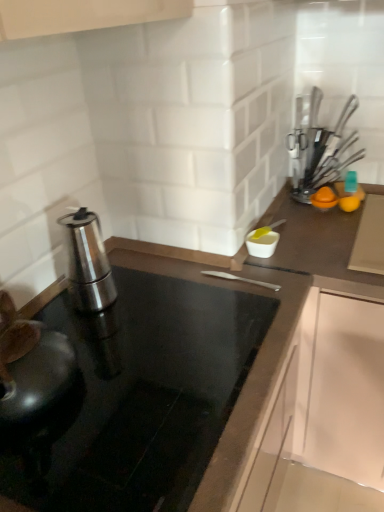
Question: Is polished stainless steel espresso maker at left, arranged as the second kitchen appliance when viewed from the top, positioned before black glass countertop at center?

Choices:
 (A) no
 (B) yes

Answer: (A)

Question: Can you confirm if polished stainless steel espresso maker at left, arranged as the 2th kitchen appliance when viewed from the back, is thinner than black glass countertop at center?

Choices:
 (A) yes
 (B) no

Answer: (A)

Question: Is polished stainless steel espresso maker at left, acting as the 1th kitchen appliance starting from the bottom, taller than black glass countertop at center?

Choices:
 (A) yes
 (B) no

Answer: (A)

Question: Is the surface of polished stainless steel espresso maker at left, arranged as the 2th kitchen appliance when viewed from the back, in direct contact with black glass countertop at center?

Choices:
 (A) no
 (B) yes

Answer: (A)

Question: Is polished stainless steel espresso maker at left, arranged as the second kitchen appliance when viewed from the top, smaller than black glass countertop at center?

Choices:
 (A) yes
 (B) no

Answer: (A)

Question: Does polished stainless steel espresso maker at left, which is the first kitchen appliance from front to back, turn towards black glass countertop at center?

Choices:
 (A) no
 (B) yes

Answer: (A)

Question: Is black glass countertop at center to the right of polished stainless steel espresso maker at left, acting as the 1th kitchen appliance starting from the bottom, from the viewer's perspective?

Choices:
 (A) no
 (B) yes

Answer: (B)

Question: Does black glass countertop at center have a greater width compared to polished stainless steel espresso maker at left, acting as the 1th kitchen appliance starting from the bottom?

Choices:
 (A) no
 (B) yes

Answer: (B)

Question: From a real-world perspective, does black glass countertop at center sit lower than polished stainless steel espresso maker at left, which is the 1th kitchen appliance in left-to-right order?

Choices:
 (A) no
 (B) yes

Answer: (B)

Question: From the image's perspective, is black glass countertop at center on polished stainless steel espresso maker at left, acting as the 1th kitchen appliance starting from the bottom?

Choices:
 (A) yes
 (B) no

Answer: (B)

Question: Considering the relative sizes of black glass countertop at center and polished stainless steel espresso maker at left, arranged as the second kitchen appliance when viewed from the top, in the image provided, is black glass countertop at center shorter than polished stainless steel espresso maker at left, arranged as the second kitchen appliance when viewed from the top,?

Choices:
 (A) no
 (B) yes

Answer: (B)

Question: Is black glass countertop at center not within polished stainless steel espresso maker at left, which is the 1th kitchen appliance in left-to-right order?

Choices:
 (A) yes
 (B) no

Answer: (A)

Question: Could you tell me if metallic silver utensils at upper right, acting as the first kitchen appliance starting from the back, is facing polished stainless steel espresso maker at left, the second kitchen appliance viewed from the right?

Choices:
 (A) yes
 (B) no

Answer: (B)